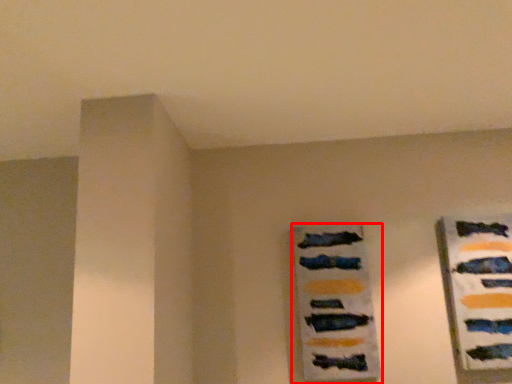
Question: In this image, where is picture frame (annotated by the red box) located relative to design?

Choices:
 (A) left
 (B) right

Answer: (A)